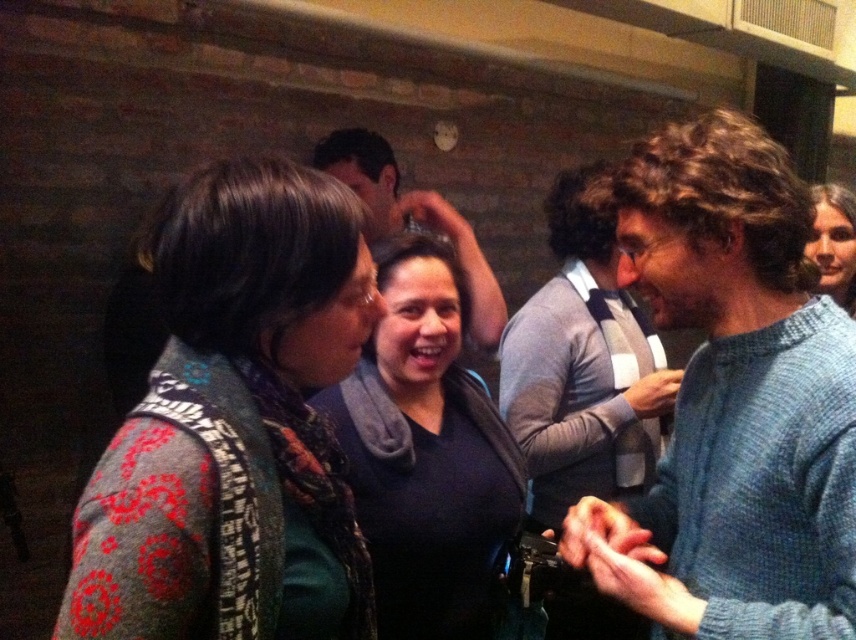
Is knitted sweater at left shorter than dark blue sweater at center?

Indeed, knitted sweater at left has a lesser height compared to dark blue sweater at center.

Where is `knitted sweater at left`? This screenshot has width=856, height=640. knitted sweater at left is located at coordinates (235, 424).

Which is behind, point (282, 339) or point (409, 540)?

Point (409, 540)

In order to click on knitted sweater at left in this screenshot , I will do `click(235, 424)`.

Which is below, knitted sweater at left or smooth skin face at upper right?

Positioned lower is knitted sweater at left.

Between knitted sweater at left and smooth skin face at upper right, which one appears on the right side from the viewer's perspective?

Positioned to the right is smooth skin face at upper right.

This screenshot has width=856, height=640. What are the coordinates of `knitted sweater at left` in the screenshot? It's located at [x=235, y=424].

Find the location of `knitted sweater at left`. knitted sweater at left is located at coordinates (235, 424).

Can you confirm if dark blue sweater at center is positioned to the left of smooth skin face at upper right?

Correct, you'll find dark blue sweater at center to the left of smooth skin face at upper right.

Which of these two, dark blue sweater at center or smooth skin face at upper right, stands shorter?

smooth skin face at upper right

What do you see at coordinates (428, 454) in the screenshot?
I see `dark blue sweater at center` at bounding box center [428, 454].

What are the coordinates of `dark blue sweater at center` in the screenshot? It's located at (428, 454).